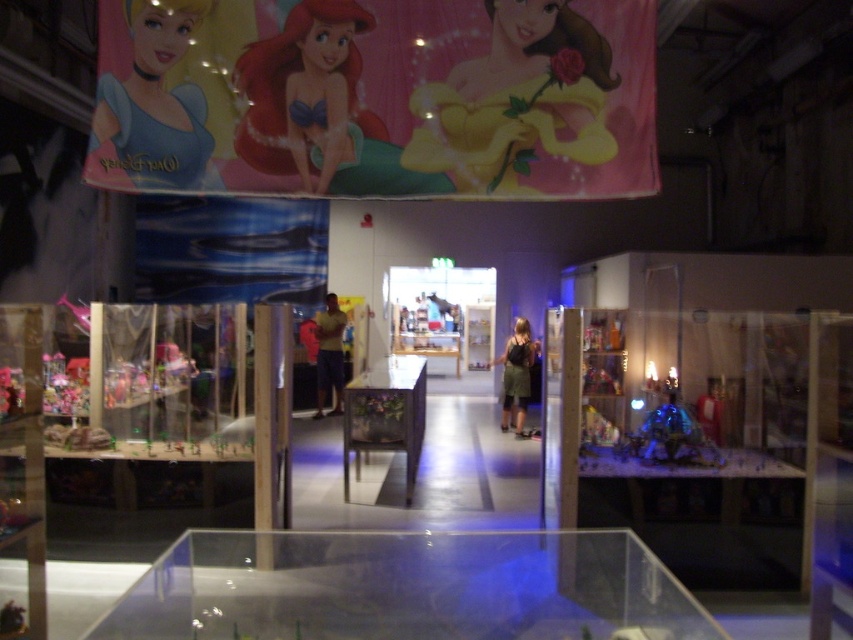
Question: Which of the following is the closest to the observer?

Choices:
 (A) (320, 340)
 (B) (358, 129)
 (C) (119, 100)
 (D) (590, 108)

Answer: (C)

Question: Does pink satin dress at upper center appear on the left side of dark green fabric dress at center?

Choices:
 (A) yes
 (B) no

Answer: (A)

Question: Is the position of matte blue fabric doll at upper center more distant than that of matte blue dress at upper left?

Choices:
 (A) no
 (B) yes

Answer: (B)

Question: Which of these objects is positioned closest to the dark green fabric dress at center?

Choices:
 (A) transparent glass table at center
 (B) yellow cotton shirt at center
 (C) pink satin dress at upper center

Answer: (B)

Question: Which point is farther to the camera?

Choices:
 (A) (180, 106)
 (B) (566, 115)
 (C) (369, 134)
 (D) (339, 364)

Answer: (D)

Question: Is matte blue dress at upper left closer to camera compared to yellow cotton shirt at center?

Choices:
 (A) no
 (B) yes

Answer: (B)